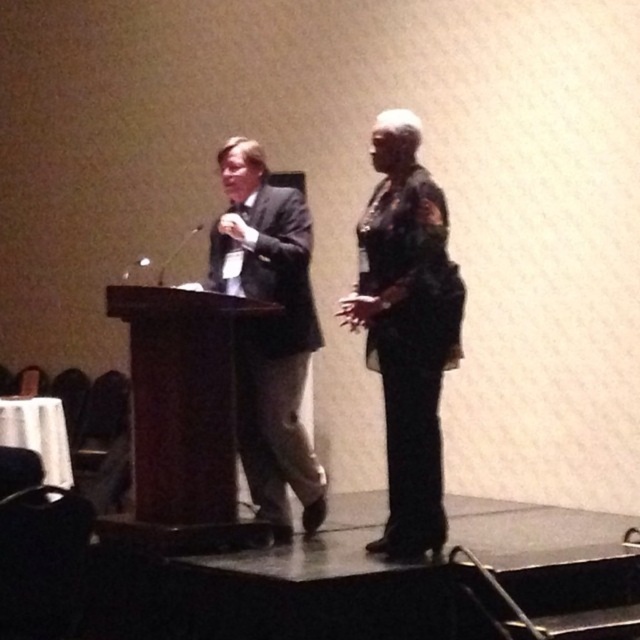
You are an event organizer trying to arrange seating for a panel discussion. You notice two presenters wearing the dark green textured blazer at center and the dark gray suit at center. Which presenter should you seat closer to the podium to ensure they have enough space for their movements?

The dark gray suit at center requires more space than the dark green textured blazer at center, so you should seat the presenter in the dark gray suit at center closer to the podium to accommodate their space needs.

You are an event organizer who needs to ensure that the dark green textured blazer at center and the brown wood podium at center do not block the audience view. Based on their sizes, which one is more likely to obstruct the view?

The brown wood podium at center is larger than the dark green textured blazer at center, so it is more likely to obstruct the audience view.